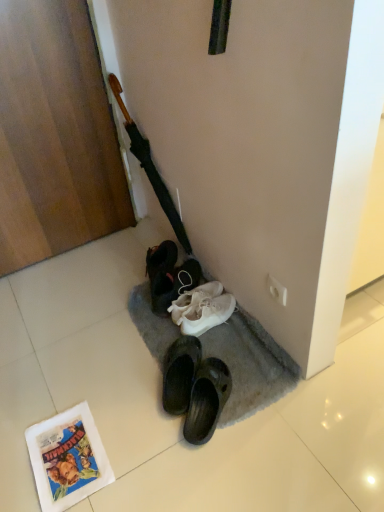
Question: Is white fabric shoe at lower center at the left side of gray carpet at lower center?

Choices:
 (A) yes
 (B) no

Answer: (A)

Question: Considering the relative sizes of white fabric shoe at lower center and gray carpet at lower center in the image provided, is white fabric shoe at lower center wider than gray carpet at lower center?

Choices:
 (A) no
 (B) yes

Answer: (A)

Question: From a real-world perspective, is white fabric shoe at lower center physically above gray carpet at lower center?

Choices:
 (A) yes
 (B) no

Answer: (A)

Question: Is gray carpet at lower center at the back of white fabric shoe at lower center?

Choices:
 (A) yes
 (B) no

Answer: (B)

Question: Considering the relative sizes of white fabric shoe at lower center and gray carpet at lower center in the image provided, is white fabric shoe at lower center thinner than gray carpet at lower center?

Choices:
 (A) no
 (B) yes

Answer: (B)

Question: Would you say white fabric shoe at lower center is to the left or to the right of gray carpet at lower center in the picture?

Choices:
 (A) left
 (B) right

Answer: (A)

Question: From a real-world perspective, relative to gray carpet at lower center, is white fabric shoe at lower center vertically above or below?

Choices:
 (A) above
 (B) below

Answer: (A)

Question: Relative to gray carpet at lower center, is white fabric shoe at lower center in front or behind?

Choices:
 (A) front
 (B) behind

Answer: (B)

Question: From their relative heights in the image, would you say white fabric shoe at lower center is taller or shorter than gray carpet at lower center?

Choices:
 (A) tall
 (B) short

Answer: (A)

Question: Is point (41, 458) closer or farther from the camera than point (170, 221)?

Choices:
 (A) closer
 (B) farther

Answer: (A)

Question: Do you think white paper comic book at lower left is within wooden crucifix at upper left, or outside of it?

Choices:
 (A) outside
 (B) inside

Answer: (A)

Question: Is white paper comic book at lower left bigger or smaller than wooden crucifix at upper left?

Choices:
 (A) small
 (B) big

Answer: (A)

Question: From the image's perspective, is white paper comic book at lower left above or below wooden crucifix at upper left?

Choices:
 (A) below
 (B) above

Answer: (A)

Question: From a real-world perspective, is white paper comic book at lower left physically located above or below wooden door at left?

Choices:
 (A) above
 (B) below

Answer: (B)

Question: Is point (102, 462) positioned closer to the camera than point (31, 74)?

Choices:
 (A) closer
 (B) farther

Answer: (A)